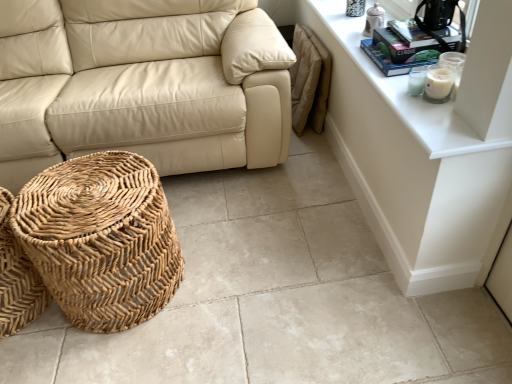
Question: From the image's perspective, relative to beige leather couch at center, is white glass candle at upper right above or below?

Choices:
 (A) below
 (B) above

Answer: (A)

Question: Is white glass candle at upper right taller or shorter than beige leather couch at center?

Choices:
 (A) tall
 (B) short

Answer: (B)

Question: Estimate the real-world distances between objects in this image. Which object is closer to the beige leather couch at center?

Choices:
 (A) white glass candle at upper right
 (B) hardcover book at upper right
 (C) woven natural basket at lower left, acting as the second basket starting from the right
 (D) natural woven basket at lower left, which is the 2th basket from left to right
 (E) white glossy dresser at upper right

Answer: (D)

Question: Estimate the real-world distances between objects in this image. Which object is farther from the natural woven basket at lower left, which is the 2th basket from left to right?

Choices:
 (A) hardcover book at upper right
 (B) white glossy dresser at upper right
 (C) woven natural basket at lower left, acting as the 1th basket starting from the left
 (D) white glass candle at upper right
 (E) beige leather couch at center

Answer: (D)